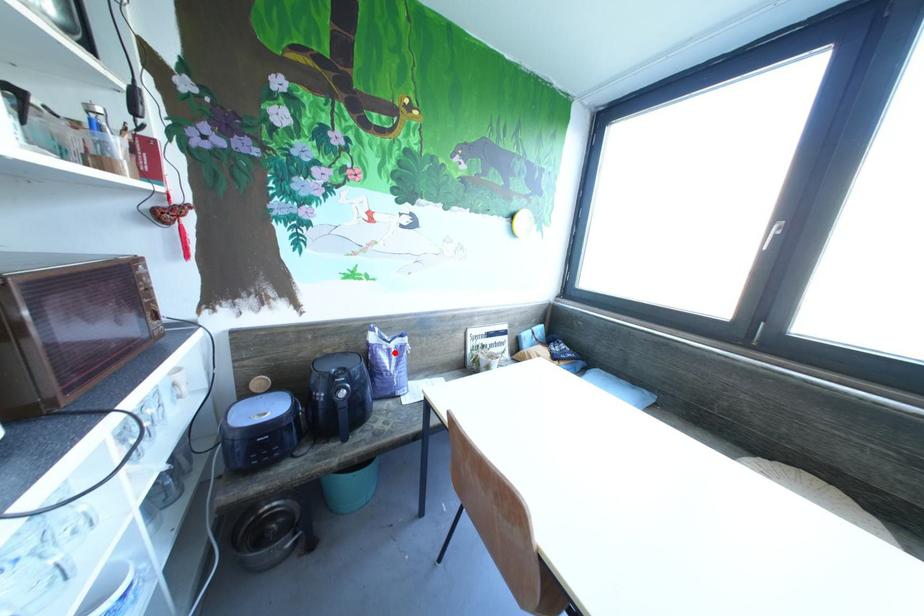
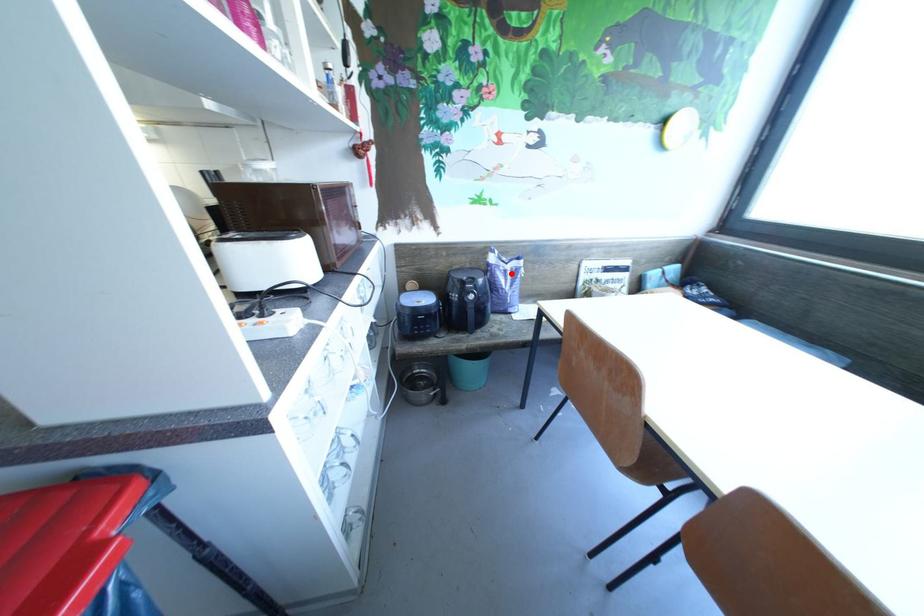
I am providing you with two images of the same scene from different viewpoints. A red point is marked on the first image and another point is marked on the second image. Are the points marked in image1 and image2 representing the same 3D position?

Yes